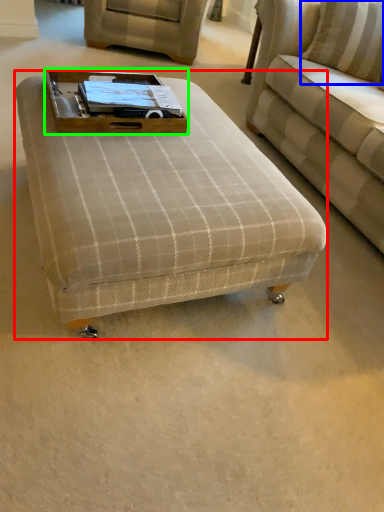
Question: Which object is positioned farthest from table (highlighted by a red box)? Select from pillow (highlighted by a blue box) and side table (highlighted by a green box).

Choices:
 (A) pillow
 (B) side table

Answer: (A)